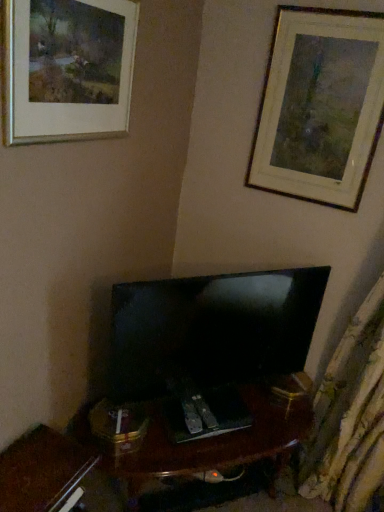
Question: Is matte black tv at center at the right side of silver metallic picture frame at upper left, the 2th picture frame from the back?

Choices:
 (A) no
 (B) yes

Answer: (B)

Question: Does matte black tv at center lie behind silver metallic picture frame at upper left, which appears as the 2th picture frame when viewed from the right?

Choices:
 (A) no
 (B) yes

Answer: (B)

Question: Is matte black tv at center bigger than silver metallic picture frame at upper left, which appears as the 2th picture frame when viewed from the right?

Choices:
 (A) no
 (B) yes

Answer: (B)

Question: Considering the relative positions of matte black tv at center and silver metallic picture frame at upper left, the 2th picture frame from the back, in the image provided, is matte black tv at center in front of silver metallic picture frame at upper left, the 2th picture frame from the back,?

Choices:
 (A) yes
 (B) no

Answer: (B)

Question: Is matte black tv at center smaller than silver metallic picture frame at upper left, the 2th picture frame from the back?

Choices:
 (A) no
 (B) yes

Answer: (A)

Question: From the image's perspective, relative to matte black tv at center, is wooden picture frame at upper right, which ranks as the first picture frame in right-to-left order, above or below?

Choices:
 (A) above
 (B) below

Answer: (A)

Question: Is wooden picture frame at upper right, positioned as the 1th picture frame in back-to-front order, taller or shorter than matte black tv at center?

Choices:
 (A) tall
 (B) short

Answer: (A)

Question: From a real-world perspective, is wooden picture frame at upper right, which is the second picture frame from front to back, positioned above or below matte black tv at center?

Choices:
 (A) below
 (B) above

Answer: (B)

Question: Is wooden picture frame at upper right, positioned as the 1th picture frame in back-to-front order, bigger or smaller than matte black tv at center?

Choices:
 (A) big
 (B) small

Answer: (B)

Question: From a real-world perspective, relative to wooden picture frame at upper right, positioned as the 2th picture frame in left-to-right order, is matte black tv at center vertically above or below?

Choices:
 (A) below
 (B) above

Answer: (A)

Question: Is matte black tv at center situated inside wooden picture frame at upper right, which is the second picture frame from front to back, or outside?

Choices:
 (A) outside
 (B) inside

Answer: (A)

Question: Is matte black tv at center taller or shorter than wooden picture frame at upper right, positioned as the 1th picture frame in back-to-front order?

Choices:
 (A) short
 (B) tall

Answer: (A)

Question: Is matte black tv at center in front of or behind wooden picture frame at upper right, positioned as the 2th picture frame in left-to-right order, in the image?

Choices:
 (A) front
 (B) behind

Answer: (A)

Question: Considering the positions of silver metallic picture frame at upper left, marked as the first picture frame in a left-to-right arrangement, and wooden picture frame at upper right, which is the second picture frame from front to back, in the image, is silver metallic picture frame at upper left, marked as the first picture frame in a left-to-right arrangement, wider or thinner than wooden picture frame at upper right, which is the second picture frame from front to back,?

Choices:
 (A) wide
 (B) thin

Answer: (A)

Question: Is silver metallic picture frame at upper left, which appears as the 2th picture frame when viewed from the right, spatially inside wooden picture frame at upper right, positioned as the 1th picture frame in back-to-front order, or outside of it?

Choices:
 (A) outside
 (B) inside

Answer: (A)